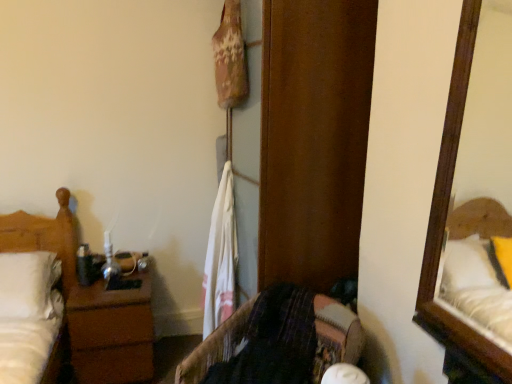
Question: Can you confirm if white matte bed at left is shorter than brown wood nightstand at left?

Choices:
 (A) yes
 (B) no

Answer: (B)

Question: Is white matte bed at left oriented towards brown wood nightstand at left?

Choices:
 (A) no
 (B) yes

Answer: (A)

Question: Is white matte bed at left outside brown wood nightstand at left?

Choices:
 (A) yes
 (B) no

Answer: (A)

Question: Considering the relative positions of white matte bed at left and brown wood nightstand at left in the image provided, is white matte bed at left behind brown wood nightstand at left?

Choices:
 (A) yes
 (B) no

Answer: (B)

Question: From a real-world perspective, is white matte bed at left physically above brown wood nightstand at left?

Choices:
 (A) yes
 (B) no

Answer: (A)

Question: Considering the relative sizes of white matte bed at left and brown wood nightstand at left in the image provided, is white matte bed at left thinner than brown wood nightstand at left?

Choices:
 (A) no
 (B) yes

Answer: (B)

Question: From a real-world perspective, is white cotton towel at center below velvet-like fabric chair at center?

Choices:
 (A) no
 (B) yes

Answer: (A)

Question: Is white cotton towel at center further to the viewer compared to velvet-like fabric chair at center?

Choices:
 (A) no
 (B) yes

Answer: (B)

Question: Does white cotton towel at center touch velvet-like fabric chair at center?

Choices:
 (A) yes
 (B) no

Answer: (B)

Question: Considering the relative positions of white cotton towel at center and velvet-like fabric chair at center in the image provided, is white cotton towel at center to the left of velvet-like fabric chair at center from the viewer's perspective?

Choices:
 (A) yes
 (B) no

Answer: (A)

Question: Is white cotton towel at center shorter than velvet-like fabric chair at center?

Choices:
 (A) no
 (B) yes

Answer: (A)

Question: Is white cotton towel at center facing away from velvet-like fabric chair at center?

Choices:
 (A) yes
 (B) no

Answer: (B)

Question: From a real-world perspective, is velvet-like fabric chair at center under white matte bed at left?

Choices:
 (A) yes
 (B) no

Answer: (A)